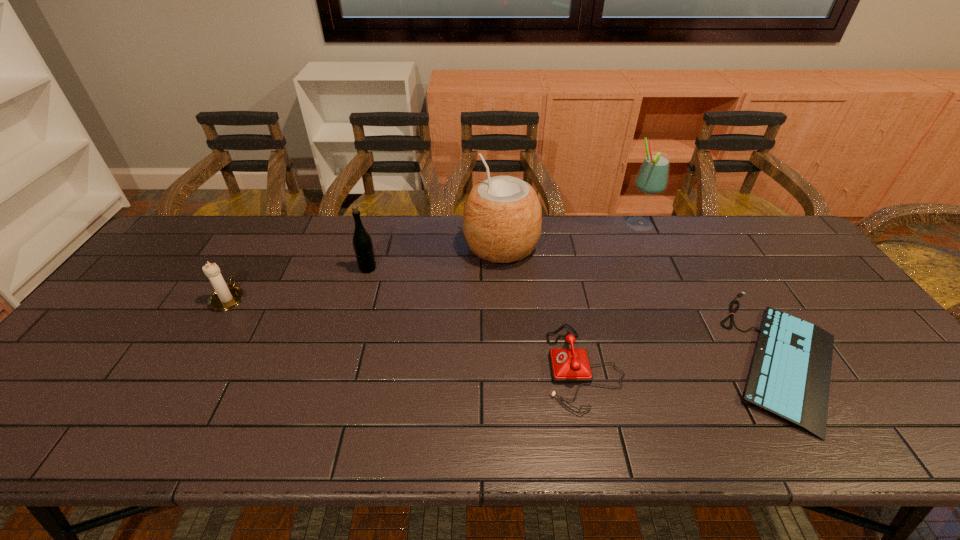
This screenshot has height=540, width=960. Identify the location of free spot located 0.370m on the front of the fifth object from right to left. (336, 378).

Where is `vacant point located 0.290m on the handle side of the candle holder`? This screenshot has height=540, width=960. vacant point located 0.290m on the handle side of the candle holder is located at coordinates (272, 226).

Identify the location of free region located on the handle side of the candle holder. The height and width of the screenshot is (540, 960). (259, 246).

Where is `vacant region located 0.290m on the handle side of the candle holder`? The width and height of the screenshot is (960, 540). vacant region located 0.290m on the handle side of the candle holder is located at coordinates (272, 226).

Where is `free region located on the dial of the fifth tallest object`? This screenshot has width=960, height=540. free region located on the dial of the fifth tallest object is located at coordinates (475, 367).

You are a GUI agent. You are given a task and a screenshot of the screen. Output one action in this format:
    pyautogui.click(x=<x>, y=<y>)
    Task: Click on the vacant space located on the dial of the fifth tallest object
    
    Given the screenshot: What is the action you would take?
    pyautogui.click(x=459, y=367)

Where is `free space located on the dial of the fifth tallest object`? This screenshot has width=960, height=540. free space located on the dial of the fifth tallest object is located at coordinates (521, 367).

You are a GUI agent. You are given a task and a screenshot of the screen. Output one action in this format:
    pyautogui.click(x=<x>, y=<y>)
    Task: Click on the vacant space situated 0.370m on the left of the computer keyboard
    
    Given the screenshot: What is the action you would take?
    pyautogui.click(x=566, y=355)

Identify the location of alcohol at the far edge. This screenshot has height=540, width=960. (652, 177).

Identify the location of coconut located at the far edge. The height and width of the screenshot is (540, 960). (502, 217).